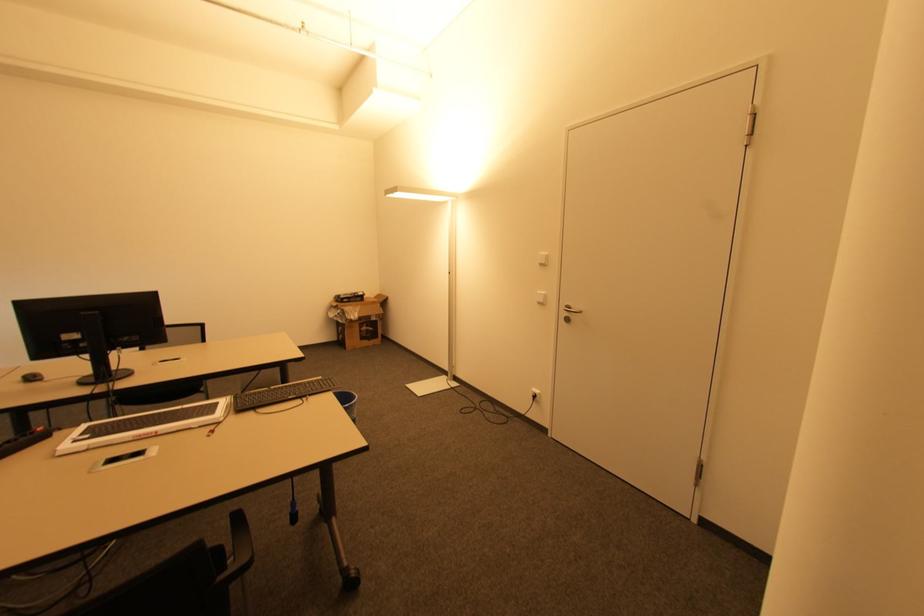
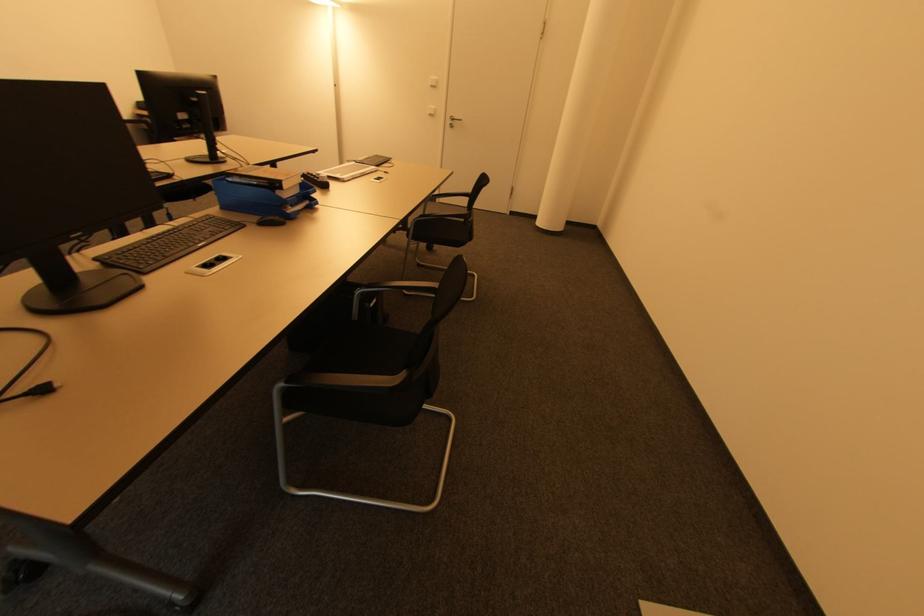
Locate, in the second image, the point that corresponds to [542,265] in the first image.

(434, 87)